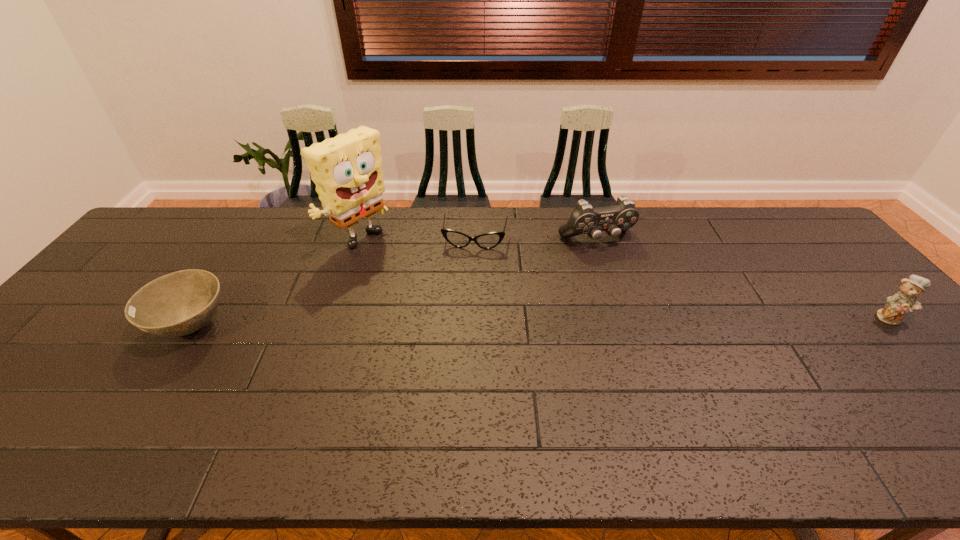
The image size is (960, 540). Identify the location of control at the far edge. (584, 219).

This screenshot has height=540, width=960. I want to click on spectacles located in the far edge section of the desktop, so click(457, 239).

Locate an element on the screen. This screenshot has height=540, width=960. object that is at the right edge is located at coordinates (904, 300).

You are a GUI agent. You are given a task and a screenshot of the screen. Output one action in this format:
    pyautogui.click(x=<x>, y=<y>)
    Task: Click on the free space at the far edge of the desktop
    The image size is (960, 540).
    Given the screenshot: What is the action you would take?
    pyautogui.click(x=445, y=240)

Locate an element on the screen. vacant space at the near edge is located at coordinates (83, 398).

The height and width of the screenshot is (540, 960). Find the location of `free spot at the left edge of the desktop`. free spot at the left edge of the desktop is located at coordinates (85, 355).

You are a GUI agent. You are given a task and a screenshot of the screen. Output one action in this format:
    pyautogui.click(x=<x>, y=<y>)
    Task: Click on the free space at the right edge of the desktop
    This screenshot has width=960, height=540.
    Given the screenshot: What is the action you would take?
    pyautogui.click(x=836, y=302)

Identify the location of vacant space at the far left corner of the desktop. (188, 238).

Where is `vacant region at the near left corner`? Image resolution: width=960 pixels, height=540 pixels. vacant region at the near left corner is located at coordinates pyautogui.click(x=23, y=387).

You are a GUI agent. You are given a task and a screenshot of the screen. Output one action in this format:
    pyautogui.click(x=<x>, y=<y>)
    Task: Click on the vacant space at the far right corner
    The width and height of the screenshot is (960, 540).
    Given the screenshot: What is the action you would take?
    pyautogui.click(x=756, y=217)